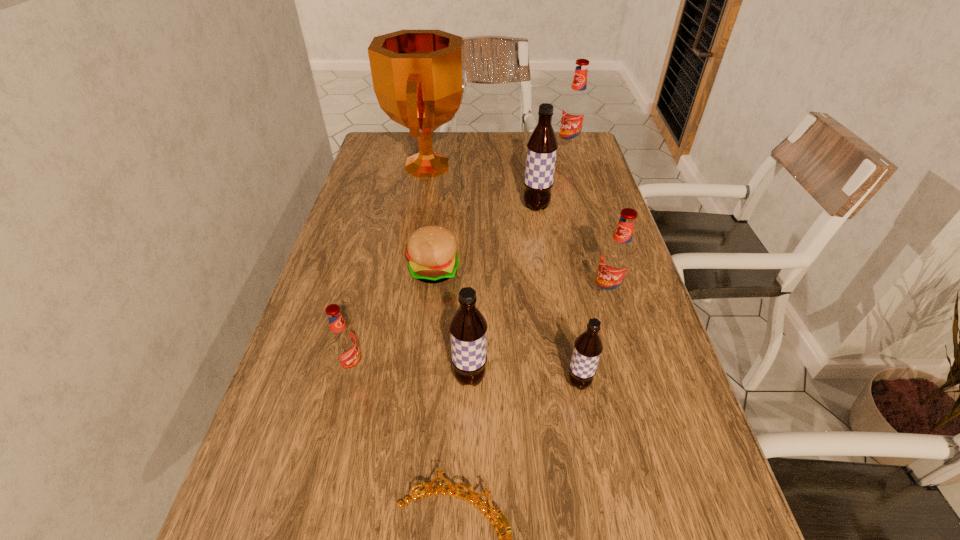
You are a GUI agent. You are given a task and a screenshot of the screen. Output one action in this format:
    pyautogui.click(x=<x>, y=<y>)
    Task: Click on the object that stands as the eighth closest to the second smallest red root beer
    
    Given the screenshot: What is the action you would take?
    pyautogui.click(x=575, y=109)

This screenshot has height=540, width=960. What are the coordinates of `root beer that can be found as the second closest to the second farthest red root beer` in the screenshot? It's located at (542, 145).

Where is `the second closest root beer relative to the fifth root beer from right to left`? The image size is (960, 540). the second closest root beer relative to the fifth root beer from right to left is located at coordinates (343, 342).

Find the location of a particular element. The width and height of the screenshot is (960, 540). red root beer identified as the second closest to the second biggest red root beer is located at coordinates (575, 109).

Where is `the third closest red root beer relative to the biggest brown root beer`? The height and width of the screenshot is (540, 960). the third closest red root beer relative to the biggest brown root beer is located at coordinates (343, 342).

Find the location of `brown root beer that is the closest one to the leftmost brown root beer`. brown root beer that is the closest one to the leftmost brown root beer is located at coordinates (588, 346).

Choose which brown root beer is the second nearest neighbor to the biggest brown root beer. Please provide its 2D coordinates. Your answer should be formatted as a tuple, i.e. [(x, y)], where the tuple contains the x and y coordinates of a point satisfying the conditions above.

[(588, 346)]

Locate an element on the screen. This screenshot has height=540, width=960. free spot that satisfies the following two spatial constraints: 1. on the front side of the farthest root beer; 2. on the side of the award with the star emblem is located at coordinates point(573,166).

At what (x,y) coordinates should I click in order to perform the action: click on vacant area in the image that satisfies the following two spatial constraints: 1. on the side of the tallest object with the star emblem; 2. on the left side of the hamburger. Please return your answer as a coordinate pair (x, y). This screenshot has height=540, width=960. Looking at the image, I should click on (413, 270).

Find the location of a particular element. The image size is (960, 540). vacant space that satisfies the following two spatial constraints: 1. on the side of the tallest object with the star emblem; 2. on the left side of the beige hamburger is located at coordinates (413, 270).